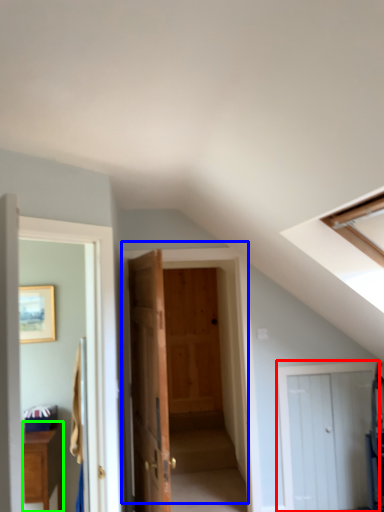
Question: Based on their relative distances, which object is farther from door (highlighted by a red box)? Choose from door (highlighted by a blue box) and cabinetry (highlighted by a green box).

Choices:
 (A) door
 (B) cabinetry

Answer: (B)